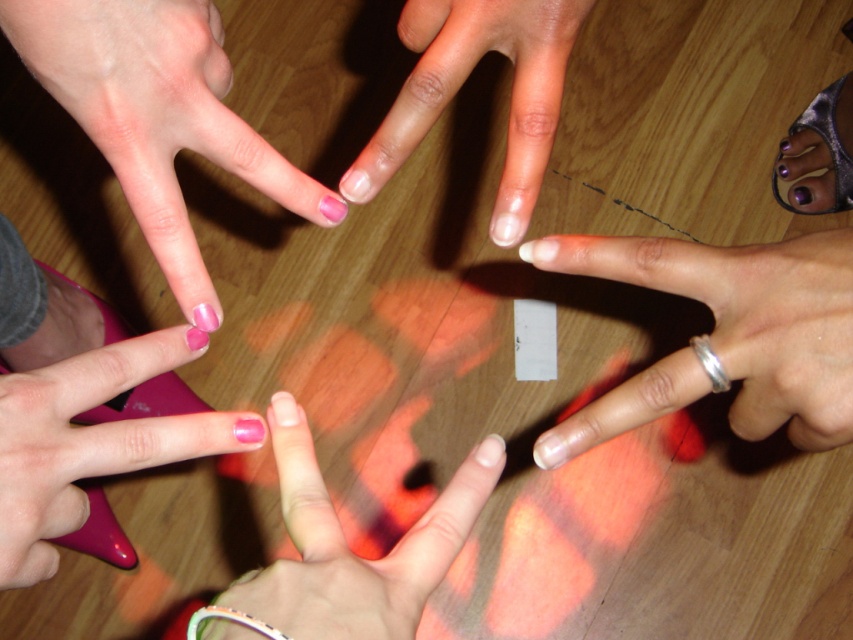
You are a photographer trying to capture a closeup of the pink matte nails at center and the silver metallic bracelet at lower right. Which object should you focus on first if you want to ensure both are in focus without moving the camera?

You should focus on the pink matte nails at center first because they are wider than the silver metallic bracelet at lower right, so ensuring the wider object is in focus will help both be sharp.

You are a photographer adjusting lighting for a closeup shot of the pink glossy nail at lower left and the pink polished nails at center. Since you want to highlight their differences in size, where should you position the light to best emphasize the size contrast between the two?

Position the light source near the pink glossy nail at lower left to cast a shadow that visually enlarges its size compared to the pink polished nails at center, thereby emphasizing their size difference.